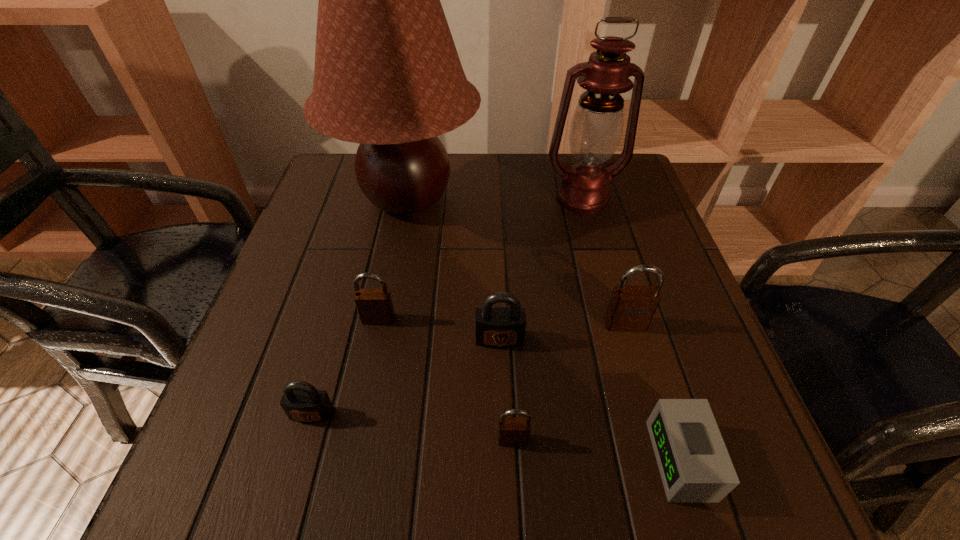
The width and height of the screenshot is (960, 540). Find the location of `vacant region at the far right corner`. vacant region at the far right corner is located at coordinates (635, 201).

The height and width of the screenshot is (540, 960). Identify the location of vacant space that's between the bigger gray padlock and the brown lampshade. (453, 269).

Where is `vacant space that's between the second brown padlock from right to left and the fourth padlock from right to left`? The width and height of the screenshot is (960, 540). vacant space that's between the second brown padlock from right to left and the fourth padlock from right to left is located at coordinates (445, 379).

Locate an element on the screen. The image size is (960, 540). vacant space that is in between the leftmost brown padlock and the alarm clock is located at coordinates (530, 389).

Image resolution: width=960 pixels, height=540 pixels. I want to click on vacant area between the alarm clock and the bigger gray padlock, so click(x=590, y=400).

I want to click on vacant area between the brown lampshade and the red oil lamp, so click(495, 199).

Where is `vacant region between the red oil lamp and the lampshade`? The width and height of the screenshot is (960, 540). vacant region between the red oil lamp and the lampshade is located at coordinates (495, 199).

Where is `vacant space that is in between the farther gray padlock and the smallest brown padlock`? vacant space that is in between the farther gray padlock and the smallest brown padlock is located at coordinates (506, 389).

At what (x,y) coordinates should I click in order to perform the action: click on free spot between the lampshade and the alarm clock. Please return your answer as a coordinate pair (x, y). This screenshot has width=960, height=540. Looking at the image, I should click on point(544,329).

Identify the location of object that is the seventh closest to the biggest brown padlock. (302, 402).